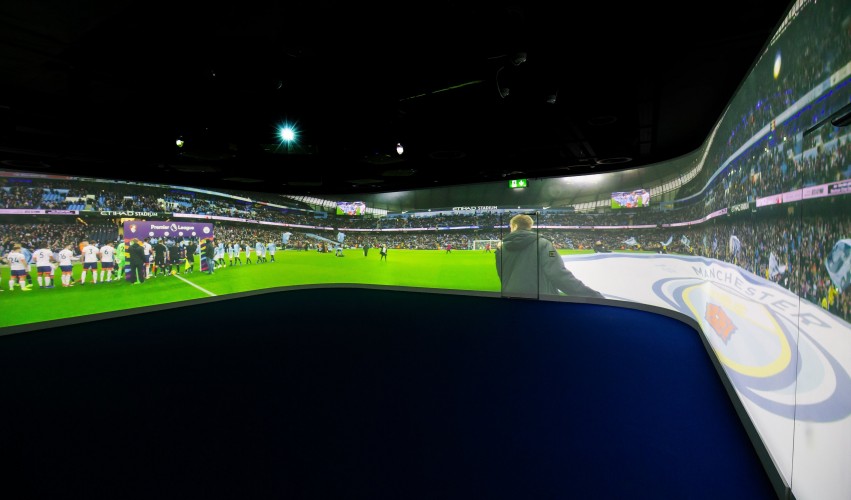
At what (x,y) coordinates should I click in order to perform the action: click on exit sign. Please return your answer as a coordinate pair (x, y). The image size is (851, 500). Looking at the image, I should click on [517, 183].